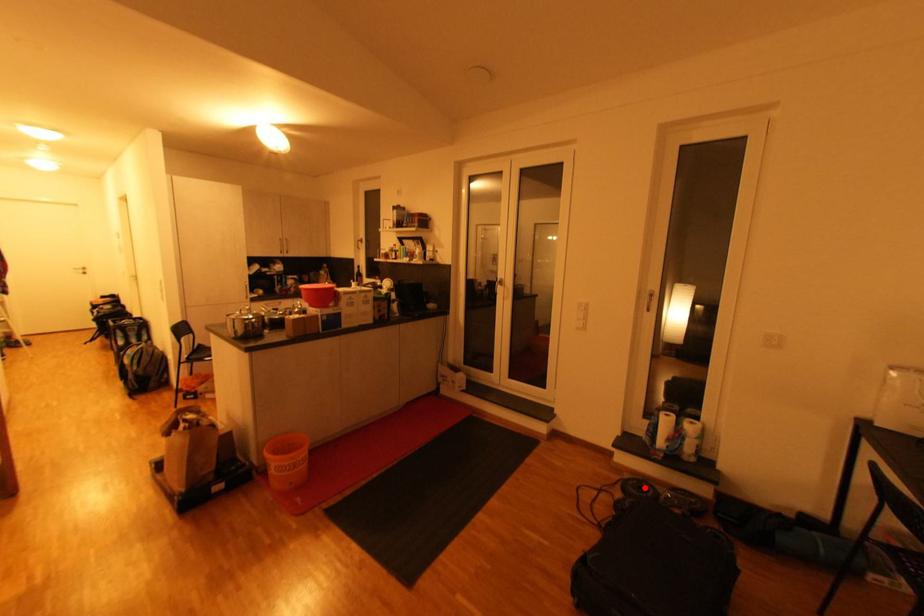
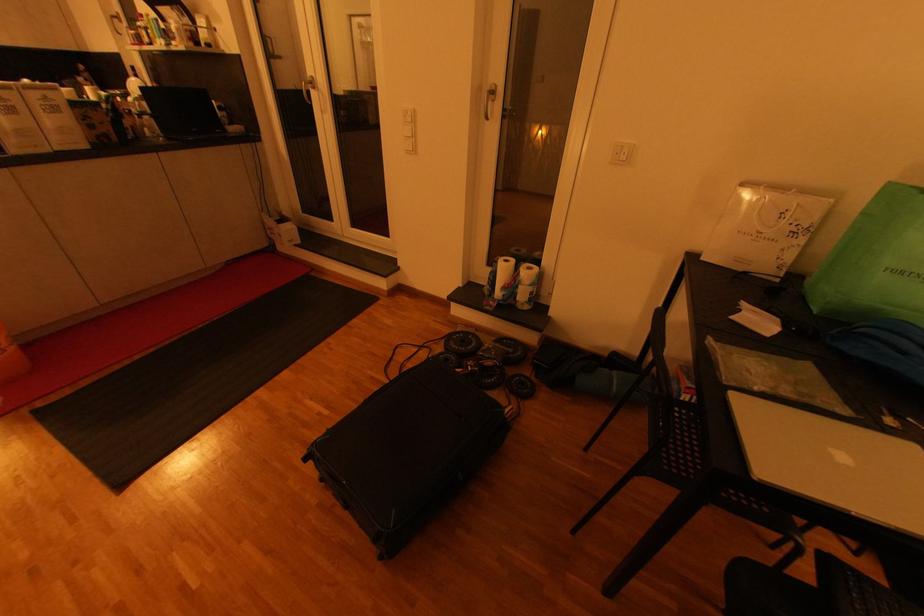
Locate, in the second image, the point that corresponds to the highlighted location in the first image.

(468, 342)